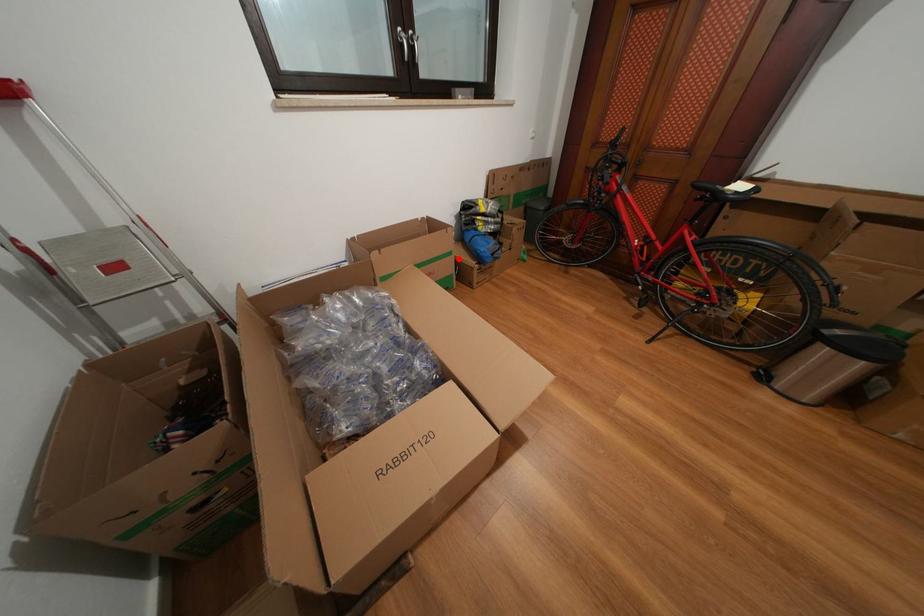
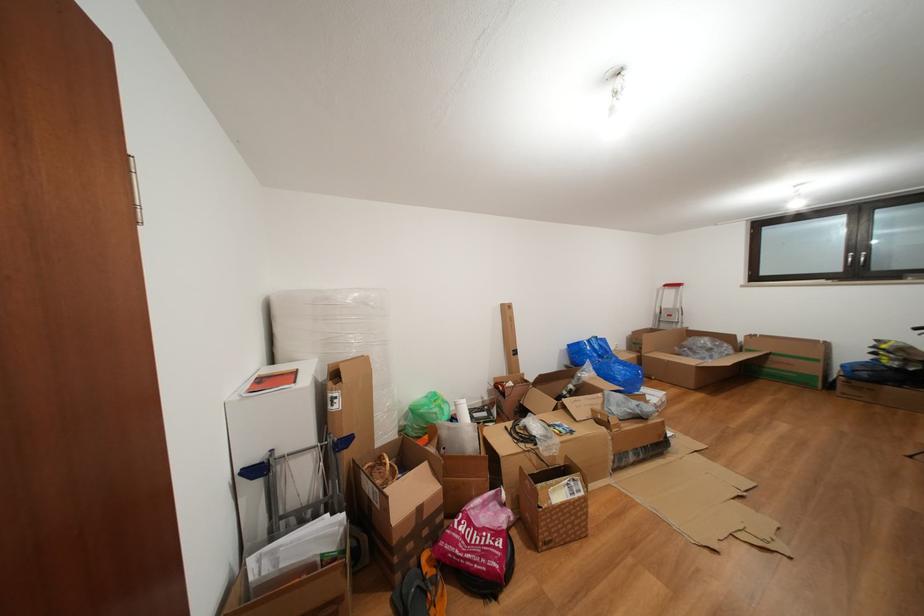
Question: I am providing you with two images of the same scene from different viewpoints. Given a red point in image1, look at the same physical point in image2. Is it:

Choices:
 (A) Closer to the viewpoint
 (B) Farther from the viewpoint

Answer: (B)